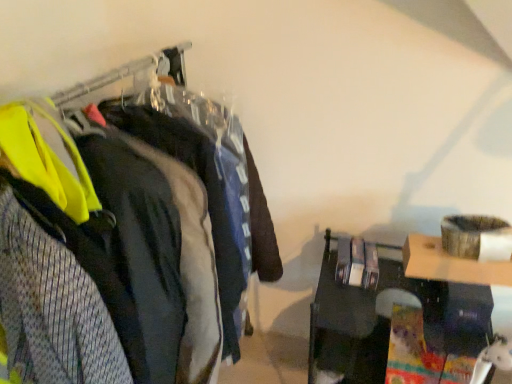
Question: Considering the positions of matte black jacket at left, the first clothing in the back-to-front sequence, and matte black jacket at left in the image, is matte black jacket at left, the first clothing in the back-to-front sequence, taller or shorter than matte black jacket at left?

Choices:
 (A) tall
 (B) short

Answer: (B)

Question: Is matte black jacket at left, the first clothing in the back-to-front sequence, to the left or to the right of matte black jacket at left in the image?

Choices:
 (A) right
 (B) left

Answer: (A)

Question: Estimate the real-world distances between objects in this image. Which object is closer to the matte black jacket at left?

Choices:
 (A) matte black jacket at left, the first clothing in the back-to-front sequence
 (B) yellow reflective vest at left, which is counted as the 1th clothing, starting from the front
 (C) black glossy table at lower right

Answer: (A)

Question: Estimate the real-world distances between objects in this image. Which object is farther from the black glossy table at lower right?

Choices:
 (A) matte black jacket at left
 (B) matte black jacket at left, positioned as the second clothing in front-to-back order
 (C) yellow reflective vest at left, which is counted as the second clothing, starting from the back

Answer: (C)